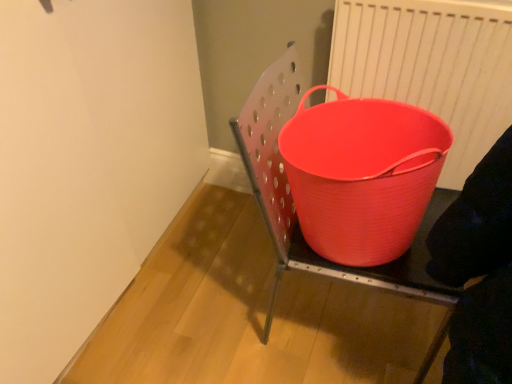
The image size is (512, 384). I want to click on vacant location below matte plastic bucket at center (from a real-world perspective), so click(342, 319).